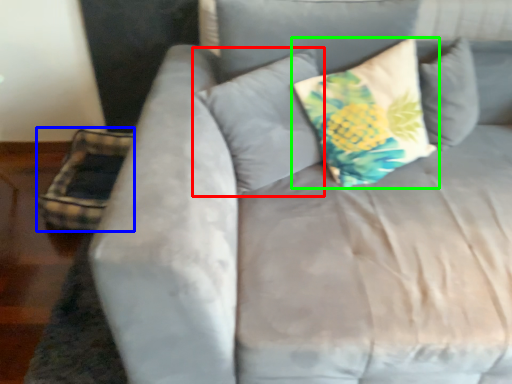
Question: Which object is positioned farthest from pillow (highlighted by a red box)? Select from pillow (highlighted by a blue box) and pillow (highlighted by a green box).

Choices:
 (A) pillow
 (B) pillow

Answer: (A)